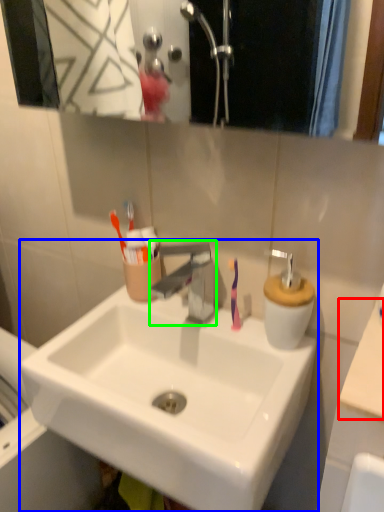
Question: Which is nearer to the counter top (highlighted by a red box)? sink (highlighted by a blue box) or tap (highlighted by a green box).

Choices:
 (A) sink
 (B) tap

Answer: (A)